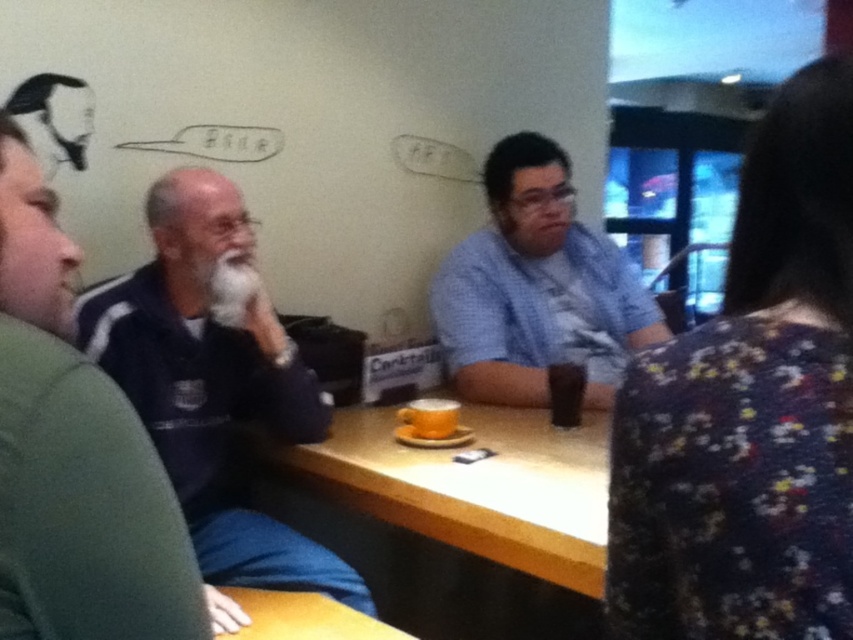
You are sitting at the wooden table at center and want to pass a napkin to the person wearing the blue checkered shirt at center. In which direction should you move the napkin to reach them?

You should move the napkin to the right since the blue checkered shirt at center is to the right of the wooden table at center.

You are standing at the camera position and want to place a small vase exactly 1.5 meters away from where you are standing. Can you place it at point (593,493)?

The distance between point (593,493) and the camera is 1.44 meters. Since 1.44 meters is less than 1.5 meters, placing the vase there would be too close. You need to move it slightly further away from the camera position to reach the desired distance.